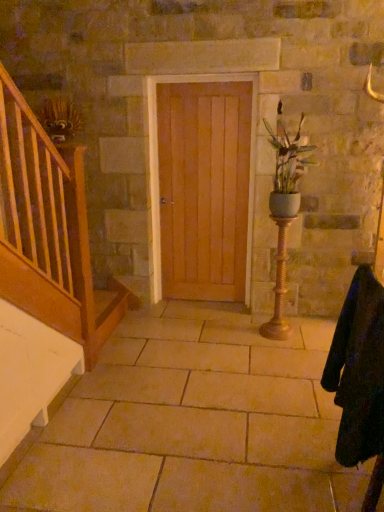
Find the location of a particular element. The width and height of the screenshot is (384, 512). free area below matte white vase at center right (from a real-world perspective) is located at coordinates (286, 339).